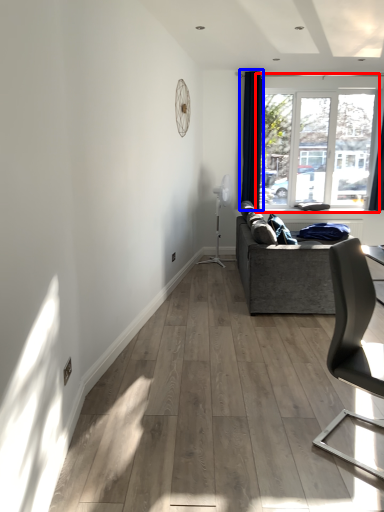
Question: Which of the following is the closest to the observer, window (highlighted by a red box) or curtain (highlighted by a blue box)?

Choices:
 (A) window
 (B) curtain

Answer: (B)